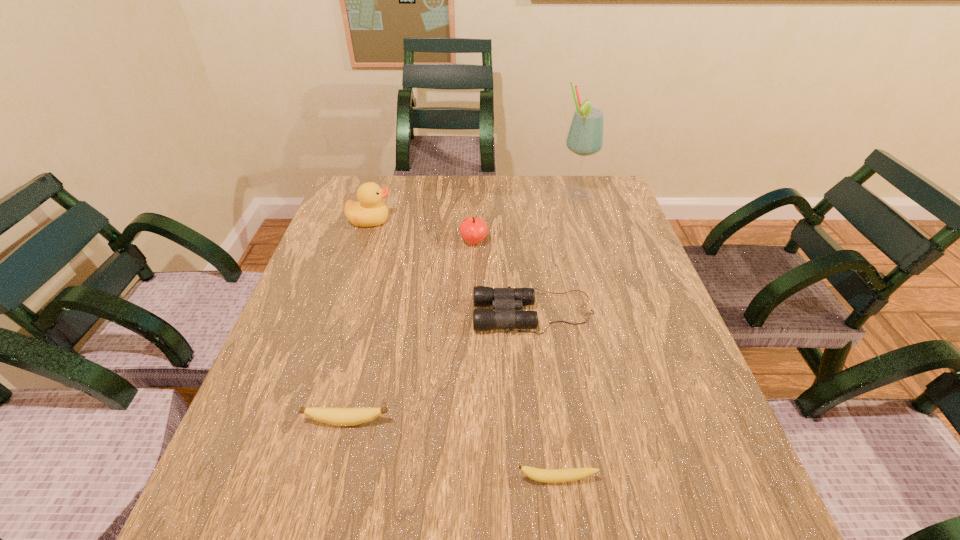
This screenshot has width=960, height=540. What are the coordinates of `vacant space at the right edge of the desktop` in the screenshot? It's located at [655, 302].

In the image, there is a desktop. Find the location of `vacant space at the near right corner`. vacant space at the near right corner is located at coordinates (681, 499).

The height and width of the screenshot is (540, 960). In order to click on free space that is in between the third nearest object and the alcohol in this screenshot , I will do `click(555, 255)`.

Where is `vacant area between the fourth tallest object and the fifth nearest object`? The height and width of the screenshot is (540, 960). vacant area between the fourth tallest object and the fifth nearest object is located at coordinates (452, 267).

Where is `free space between the third shortest object and the duck`? free space between the third shortest object and the duck is located at coordinates (452, 267).

The width and height of the screenshot is (960, 540). Find the location of `free space between the second tallest object and the left banana`. free space between the second tallest object and the left banana is located at coordinates (358, 321).

The width and height of the screenshot is (960, 540). I want to click on free space between the third tallest object and the right banana, so click(516, 361).

Where is `unoccupied position between the duck and the second nearest object`? unoccupied position between the duck and the second nearest object is located at coordinates (358, 321).

You are a GUI agent. You are given a task and a screenshot of the screen. Output one action in this format:
    pyautogui.click(x=<x>, y=<y>)
    Task: Click on the blank region between the nearer banana and the second farthest object
    The width and height of the screenshot is (960, 540).
    Given the screenshot: What is the action you would take?
    pyautogui.click(x=464, y=350)

Locate an element on the screen. This screenshot has width=960, height=540. free spot between the third shortest object and the duck is located at coordinates (452, 267).